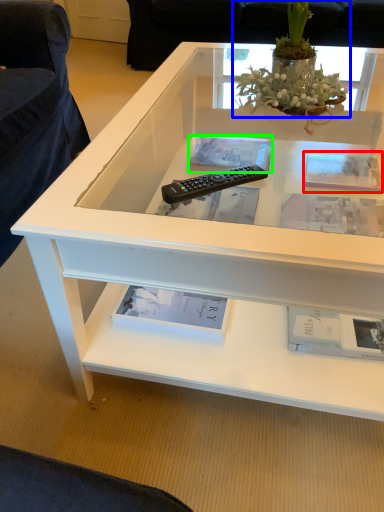
Question: Based on their relative distances, which object is nearer to square (highlighted by a red box)? Choose from houseplant (highlighted by a blue box) and book (highlighted by a green box).

Choices:
 (A) houseplant
 (B) book

Answer: (B)